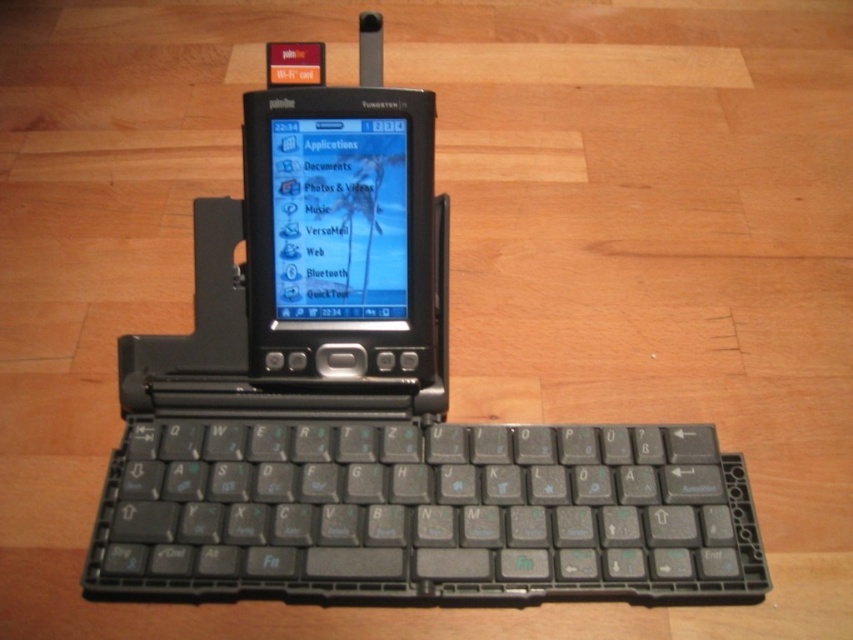
You are holding a PalmOne Treo 650 smartphone. There is a point at coordinates (x=422, y=512) on the phone. What is located at this point?

The point at coordinates (x=422, y=512) marks the black plastic keyboard at center.

You are trying to locate the black plastic keyboard at center on the PalmOne Treo 650 smartphone. According to the coordinates provided, where exactly is it positioned?

The black plastic keyboard at center is positioned at coordinates point (422, 512).

You are trying to place a protective cover over both the black plastic keyboard at center and the matte plastic screen at center of the PalmOne Treo 650. The cover you have is only wide enough to fit the larger of the two. Which part should the cover be designed to accommodate?

The black plastic keyboard at center has a larger width than the matte plastic screen at center, so the cover should be designed to accommodate the black plastic keyboard at center.